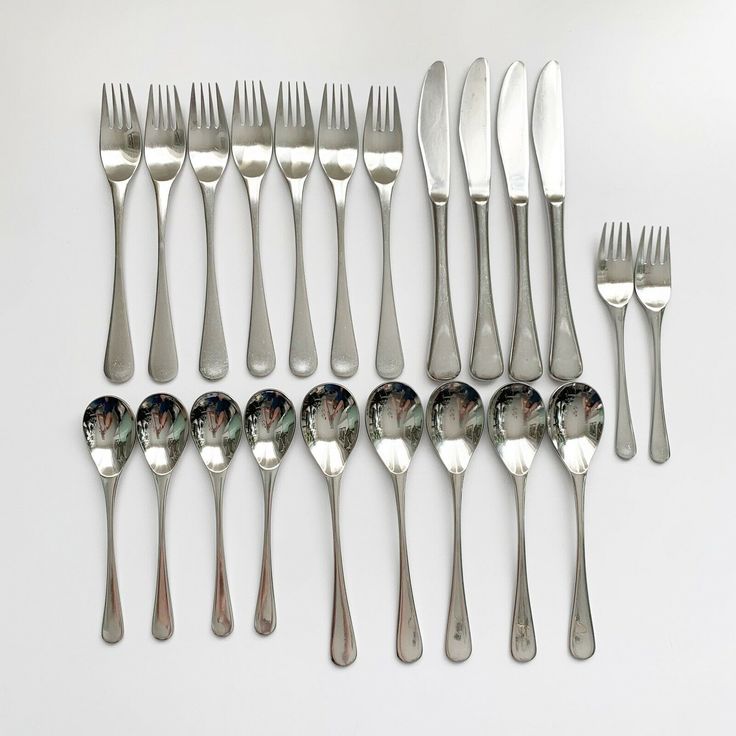
At what (x,y) coordinates should I click in order to perform the action: click on forks. Please return your answer as a coordinate pair (x, y). Image resolution: width=736 pixels, height=736 pixels. Looking at the image, I should click on (611, 283), (653, 283), (382, 135), (330, 138), (302, 138), (251, 144), (213, 144), (169, 144), (116, 146).